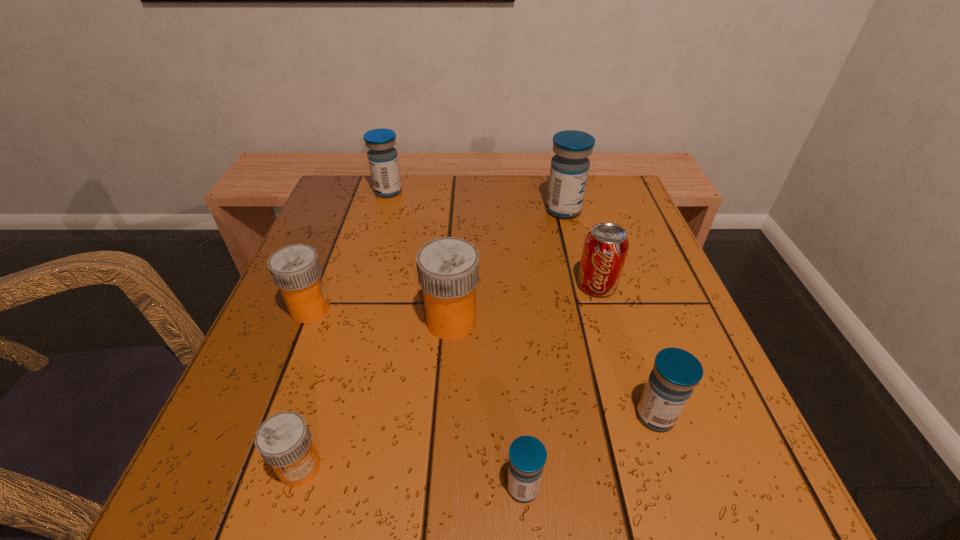
At what (x,y) coordinates should I click in order to perform the action: click on object that can be found as the fifth closest to the smallest orange medicine. Please return your answer as a coordinate pair (x, y). This screenshot has width=960, height=540. Looking at the image, I should click on (605, 248).

The width and height of the screenshot is (960, 540). In order to click on medicine that is the sixth nearest to the fourth object from left to right in this screenshot , I will do `click(383, 161)`.

Identify which medicine is located as the sixth nearest to the leftmost orange medicine. Please provide its 2D coordinates. Your answer should be formatted as a tuple, i.e. [(x, y)], where the tuple contains the x and y coordinates of a point satisfying the conditions above.

[(676, 372)]

Locate which blue medicine ranks fourth in proximity to the soda can. Please provide its 2D coordinates. Your answer should be formatted as a tuple, i.e. [(x, y)], where the tuple contains the x and y coordinates of a point satisfying the conditions above.

[(383, 161)]

Locate an element on the screen. This screenshot has width=960, height=540. blue medicine that is the closest to the leftmost object is located at coordinates (383, 161).

Select which orange medicine is the second closest to the fourth object from left to right. Please provide its 2D coordinates. Your answer should be formatted as a tuple, i.e. [(x, y)], where the tuple contains the x and y coordinates of a point satisfying the conditions above.

[(283, 440)]

Where is `orange medicine that is the closest to the leftmost object`? This screenshot has width=960, height=540. orange medicine that is the closest to the leftmost object is located at coordinates (448, 268).

Locate an element on the screen. This screenshot has width=960, height=540. vacant area that satisfies the following two spatial constraints: 1. on the label side of the fifth object from right to left; 2. on the label side of the nearest orange medicine is located at coordinates (443, 468).

Where is `free space that satisfies the following two spatial constraints: 1. on the label side of the third nearest medicine; 2. on the right side of the leftmost object`? free space that satisfies the following two spatial constraints: 1. on the label side of the third nearest medicine; 2. on the right side of the leftmost object is located at coordinates (268, 416).

The width and height of the screenshot is (960, 540). Identify the location of free space that satisfies the following two spatial constraints: 1. on the front side of the sixth nearest medicine; 2. on the left side of the soda can. (583, 285).